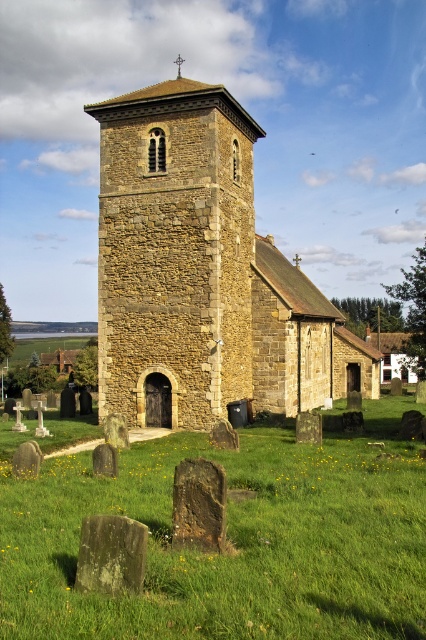
You are standing in a field and see the green grassy at center and the brown stone church at center. Which one is taller?

The brown stone church at center is taller than the green grassy at center.